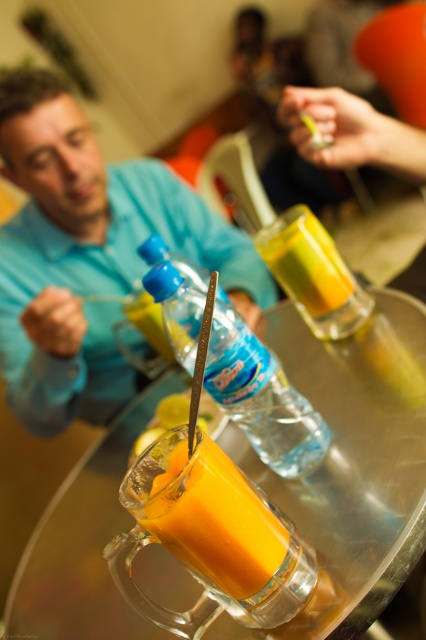
You are at a party and want to grab a drink. There are two points on the table where drinks might be. Which point is closer to you, point (x=293, y=404) or point (x=258, y=525)?

Point (x=293, y=404) is closer to you because it is further to the camera than point (x=258, y=525).

You are at a party and need to reach the translucent plastic juice at center. There is a blue matte shirt at upper left in the way. Can you easily access the juice without moving the shirt?

The blue matte shirt at upper left is taller than the translucent plastic juice at center, so it might block your view or access. You may need to move the shirt to reach the juice.

You are at a party and want to grab a drink. You see a translucent glass mug at center and a translucent plastic juice at center. Which one is closer to you?

The translucent glass mug at center is closer to you because it is below the translucent plastic juice at center, indicating it is in front.